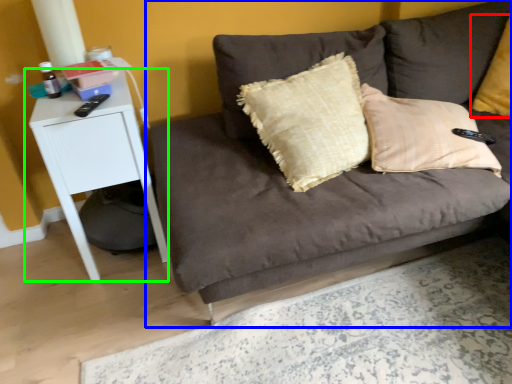
Question: Which object is the farthest from pillow (highlighted by a red box)? Choose among these: studio couch (highlighted by a blue box) or table (highlighted by a green box).

Choices:
 (A) studio couch
 (B) table

Answer: (B)